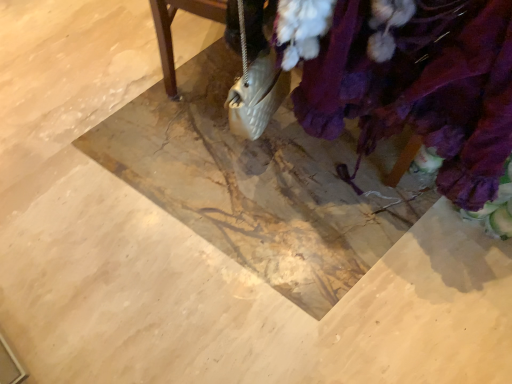
Image resolution: width=512 pixels, height=384 pixels. What do you see at coordinates (421, 88) in the screenshot?
I see `purple velvet dress at center` at bounding box center [421, 88].

What is the approximate width of purple velvet dress at center?

The width of purple velvet dress at center is 24.56 inches.

Image resolution: width=512 pixels, height=384 pixels. I want to click on purple velvet dress at center, so 421,88.

In order to face purple velvet dress at center, should I rotate leftwards or rightwards?

You should rotate right by 22.600 degrees.

The width and height of the screenshot is (512, 384). Find the location of `purple velvet dress at center`. purple velvet dress at center is located at coordinates (421, 88).